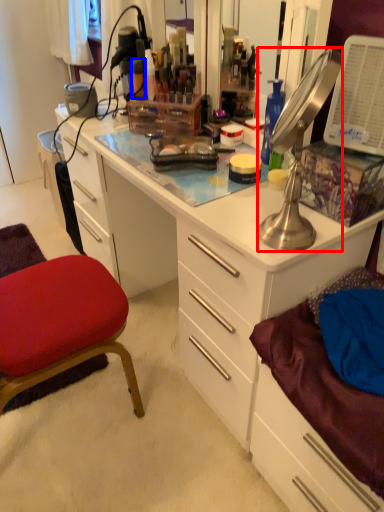
Question: Among these objects, which one is farthest to the camera, lamp (highlighted by a red box) or toiletry (highlighted by a blue box)?

Choices:
 (A) lamp
 (B) toiletry

Answer: (B)